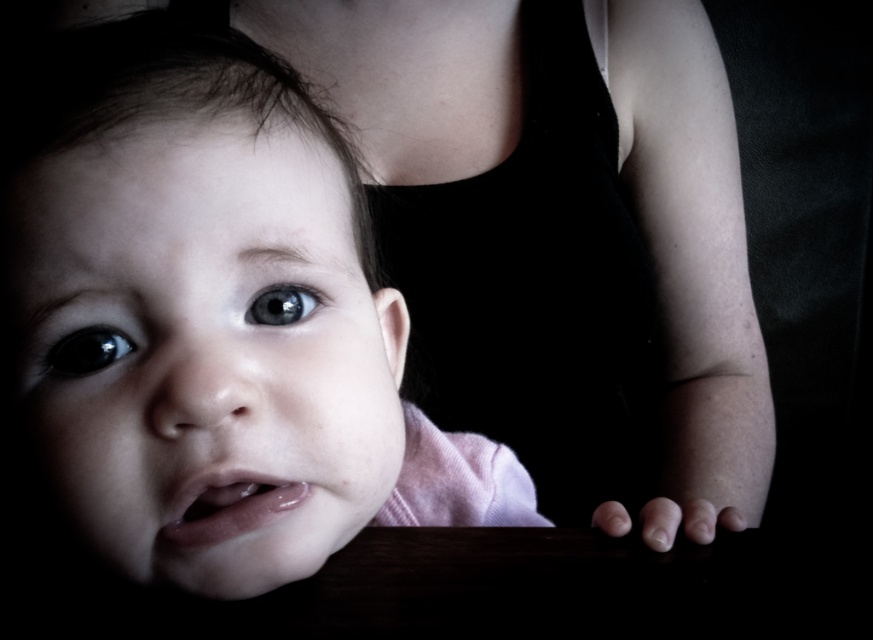
Question: Which of the following is the farthest from the observer?

Choices:
 (A) (650, 33)
 (B) (285, 314)

Answer: (A)

Question: Which point is closer to the camera?

Choices:
 (A) blue glossy eye at center
 (B) glossy black eye at center
 (C) smooth skin baby at center

Answer: (B)

Question: Which object is the closest to the glossy black eye at center?

Choices:
 (A) pink fabric at center
 (B) blue glossy eye at center

Answer: (B)

Question: Is pink fabric at center further to the viewer compared to glossy black eye at center?

Choices:
 (A) yes
 (B) no

Answer: (B)

Question: Is pink fabric at center further to camera compared to glossy black eye at center?

Choices:
 (A) yes
 (B) no

Answer: (B)

Question: Does smooth skin baby at center come in front of glossy black eye at center?

Choices:
 (A) yes
 (B) no

Answer: (B)